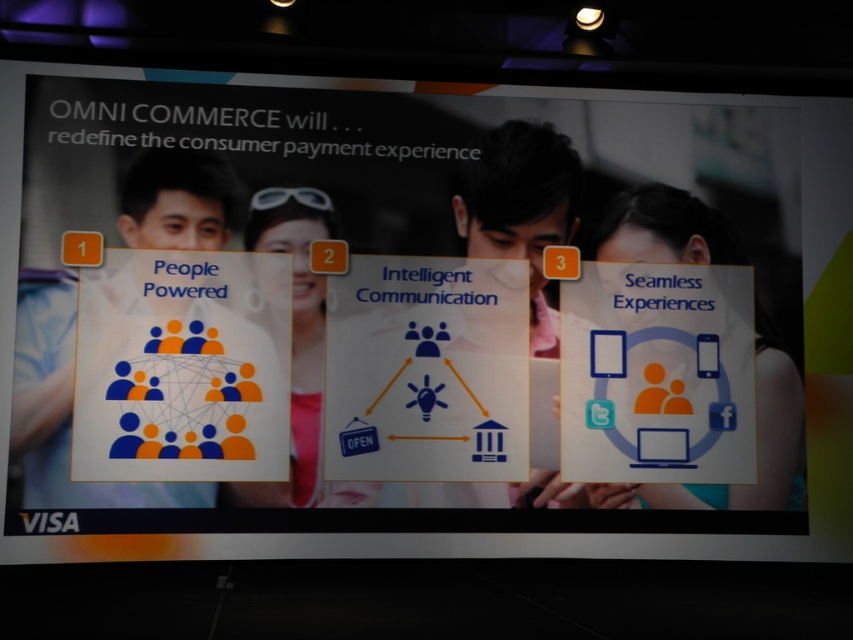
You are designing a presentation slide about Omni Commerce and need to adjust the layout. If you want to make the blue matte people at left and the matte orange woman at center have the same width, which object should you enlarge?

The blue matte people at left is thinner than the matte orange woman at center, so you should enlarge the blue matte people at left to match the width of the matte orange woman at center.

What is the color of the object located at point [62,406]?

The object at point [62,406] is blue matte people at left.